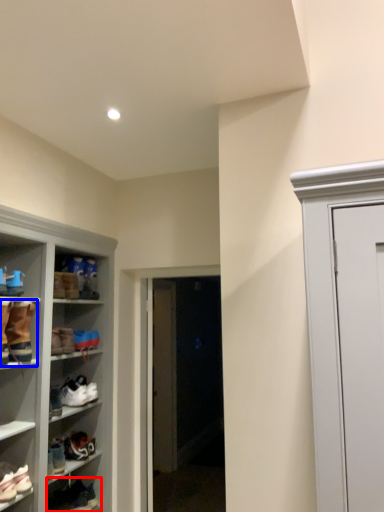
Question: Which object is further to the camera taking this photo, footwear (highlighted by a red box) or footwear (highlighted by a blue box)?

Choices:
 (A) footwear
 (B) footwear

Answer: (A)